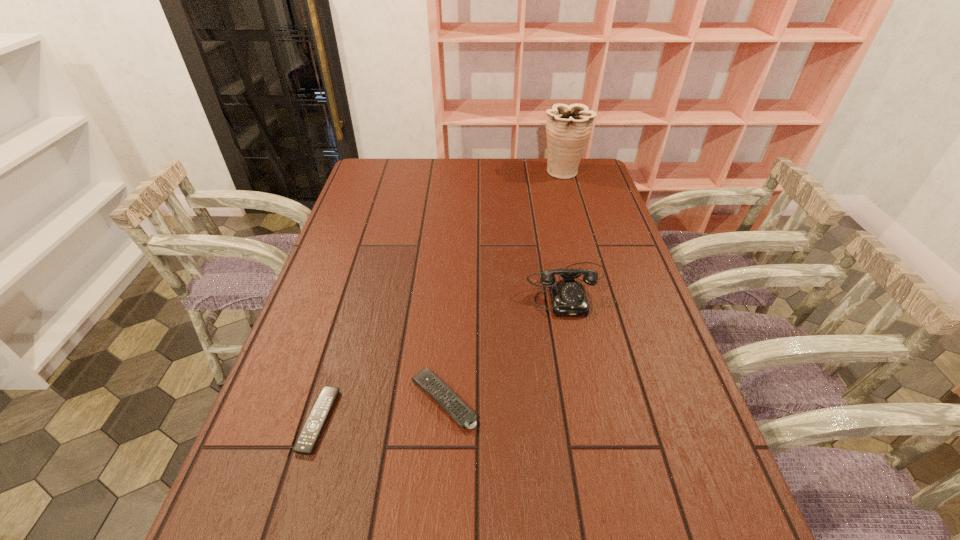
What are the coordinates of `vacant space located on the left of the second object from left to right` in the screenshot? It's located at (322, 400).

Locate an element on the screen. free location located on the right of the shortest object is located at coordinates (372, 421).

Where is `object that is at the far edge`? This screenshot has height=540, width=960. object that is at the far edge is located at coordinates (568, 127).

Where is `object present at the left edge`? The height and width of the screenshot is (540, 960). object present at the left edge is located at coordinates (308, 437).

You are a GUI agent. You are given a task and a screenshot of the screen. Output one action in this format:
    pyautogui.click(x=<x>, y=<y>)
    Task: Click on the urn situated at the right edge
    The width and height of the screenshot is (960, 540).
    Given the screenshot: What is the action you would take?
    pyautogui.click(x=568, y=127)

Locate an element on the screen. The width and height of the screenshot is (960, 540). telephone that is at the right edge is located at coordinates (568, 297).

You are a GUI agent. You are given a task and a screenshot of the screen. Output one action in this format:
    pyautogui.click(x=<x>, y=<y>)
    Task: Click on the object that is at the far right corner
    
    Given the screenshot: What is the action you would take?
    [x=568, y=127]

This screenshot has height=540, width=960. In the image, there is a desktop. In order to click on vacant space at the far edge in this screenshot , I will do `click(429, 186)`.

Locate an element on the screen. This screenshot has width=960, height=540. free point at the left edge is located at coordinates (339, 299).

Where is `vacant space at the right edge of the desktop`? This screenshot has width=960, height=540. vacant space at the right edge of the desktop is located at coordinates (587, 227).